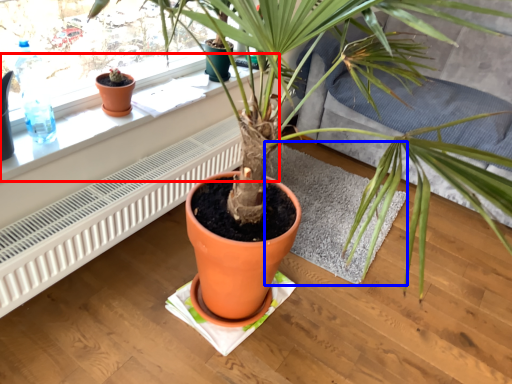
Question: Which of the following is the farthest to the observer, window sill (highlighted by a red box) or wide (highlighted by a blue box)?

Choices:
 (A) window sill
 (B) wide

Answer: (B)